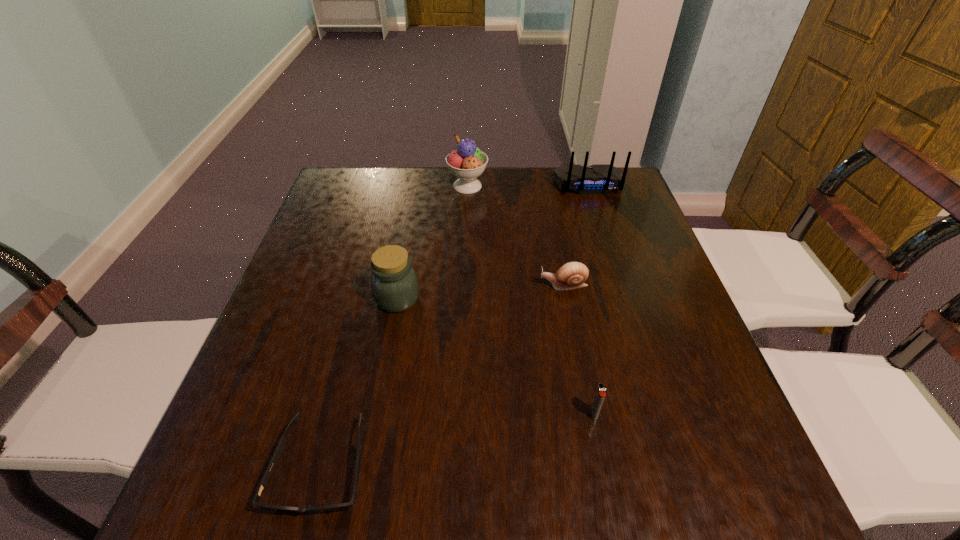
Locate an element on the screen. The width and height of the screenshot is (960, 540). blank area located on the right of the jar is located at coordinates (494, 299).

Image resolution: width=960 pixels, height=540 pixels. Find the location of `vacant point located on the left of the second nearest object`. vacant point located on the left of the second nearest object is located at coordinates (475, 414).

This screenshot has height=540, width=960. Find the location of `vacant space located 0.270m on the front-facing side of the fifth tallest object`. vacant space located 0.270m on the front-facing side of the fifth tallest object is located at coordinates (425, 285).

This screenshot has width=960, height=540. I want to click on vacant space located on the front-facing side of the fifth tallest object, so click(x=497, y=285).

Where is `free space located 0.110m on the front-facing side of the fifth tallest object`? Image resolution: width=960 pixels, height=540 pixels. free space located 0.110m on the front-facing side of the fifth tallest object is located at coordinates (493, 285).

Locate an element on the screen. The width and height of the screenshot is (960, 540). icecream at the far edge is located at coordinates (468, 162).

What are the coordinates of `router at the far edge` in the screenshot? It's located at (597, 179).

Identify the location of object that is at the near edge. The width and height of the screenshot is (960, 540). (279, 449).

At what (x,y) coordinates should I click in order to perform the action: click on object that is at the left edge. Please return your answer as a coordinate pair (x, y). This screenshot has width=960, height=540. Looking at the image, I should click on (279, 449).

Where is `object located in the right edge section of the desktop`? This screenshot has width=960, height=540. object located in the right edge section of the desktop is located at coordinates (597, 179).